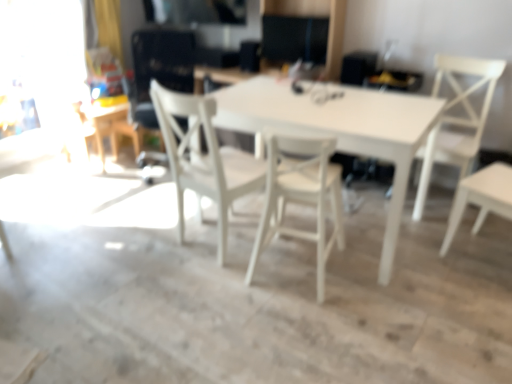
What are the coordinates of `vacant space in front of white matte table at center, the 2th table from the back` in the screenshot? It's located at (317, 319).